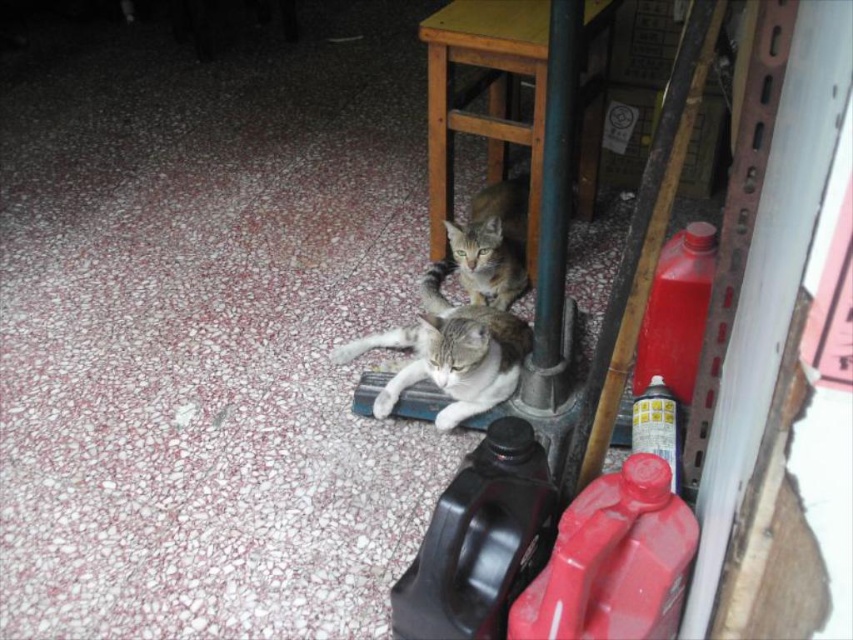
Which is above, gray tabby cat at center or tabby fur cat at center?

tabby fur cat at center is higher up.

Image resolution: width=853 pixels, height=640 pixels. What do you see at coordinates (451, 358) in the screenshot?
I see `gray tabby cat at center` at bounding box center [451, 358].

Image resolution: width=853 pixels, height=640 pixels. In order to click on gray tabby cat at center in this screenshot , I will do `click(451, 358)`.

Does wooden table at upper center come behind tabby fur cat at center?

No, wooden table at upper center is in front of tabby fur cat at center.

This screenshot has width=853, height=640. Identify the location of wooden table at upper center. (488, 97).

Measure the distance between point (543, 131) and camera.

Point (543, 131) and camera are 4.87 feet apart.

The width and height of the screenshot is (853, 640). I want to click on wooden table at upper center, so click(488, 97).

Can you confirm if wooden table at upper center is positioned above gray tabby cat at center?

Yes.

Where is `wooden table at upper center`? This screenshot has width=853, height=640. wooden table at upper center is located at coordinates (488, 97).

Where is `wooden table at upper center`? This screenshot has width=853, height=640. wooden table at upper center is located at coordinates (488, 97).